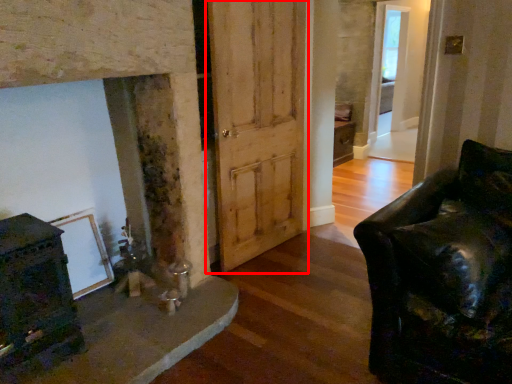
Question: From the image's perspective, considering the relative positions of barn door (annotated by the red box) and glass door in the image provided, where is barn door (annotated by the red box) located with respect to the staircase?

Choices:
 (A) below
 (B) above

Answer: (A)